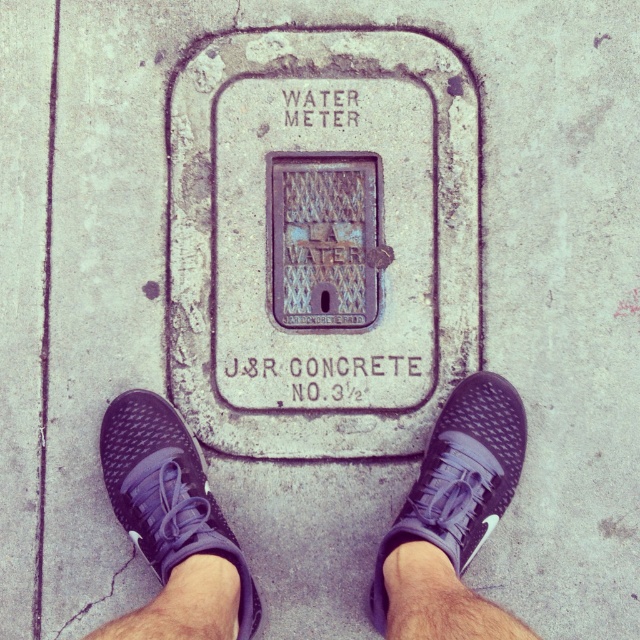
Question: Observing the image, what is the correct spatial positioning of matte black shoe at center in reference to black mesh shoe at center?

Choices:
 (A) below
 (B) above

Answer: (A)

Question: Among these objects, which one is nearest to the camera?

Choices:
 (A) matte black shoe at center
 (B) black mesh sneakers at center

Answer: (B)

Question: Can you confirm if matte black shoe at center is bigger than black mesh shoe at center?

Choices:
 (A) yes
 (B) no

Answer: (A)

Question: Is black mesh sneakers at center wider than black mesh shoe at center?

Choices:
 (A) no
 (B) yes

Answer: (A)

Question: Which point is closer to the camera?

Choices:
 (A) (374, 573)
 (B) (145, 499)
 (C) (460, 445)

Answer: (B)

Question: Which of these objects is positioned farthest from the black mesh shoe at center?

Choices:
 (A) black mesh sneakers at center
 (B) matte black shoe at center

Answer: (B)